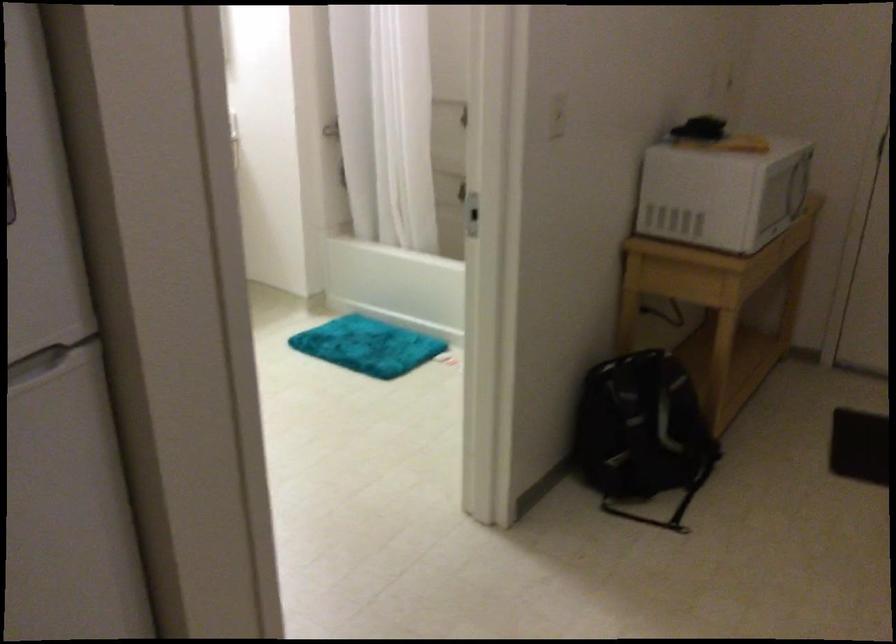
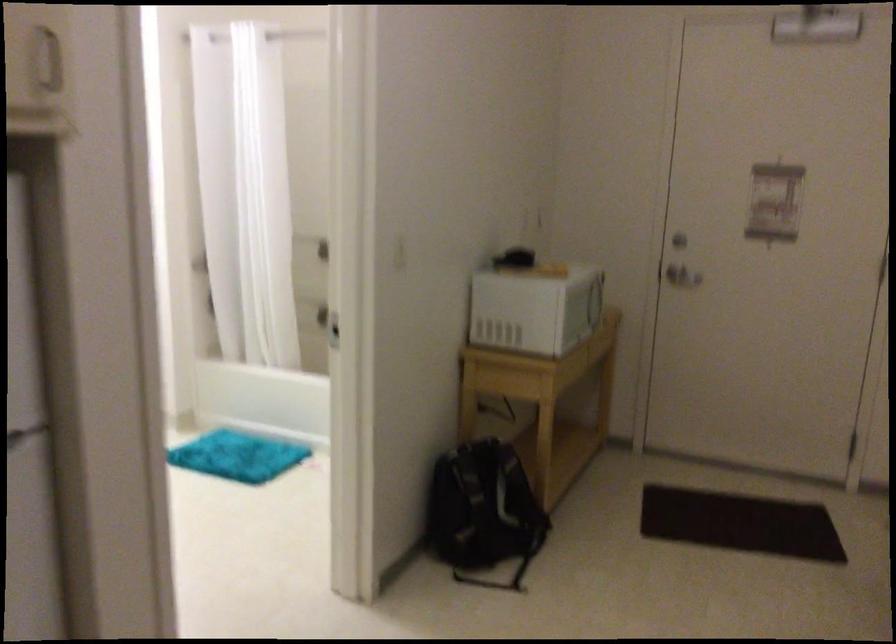
The point at (790,185) is marked in the first image. Where is the corresponding point in the second image?

(596, 301)